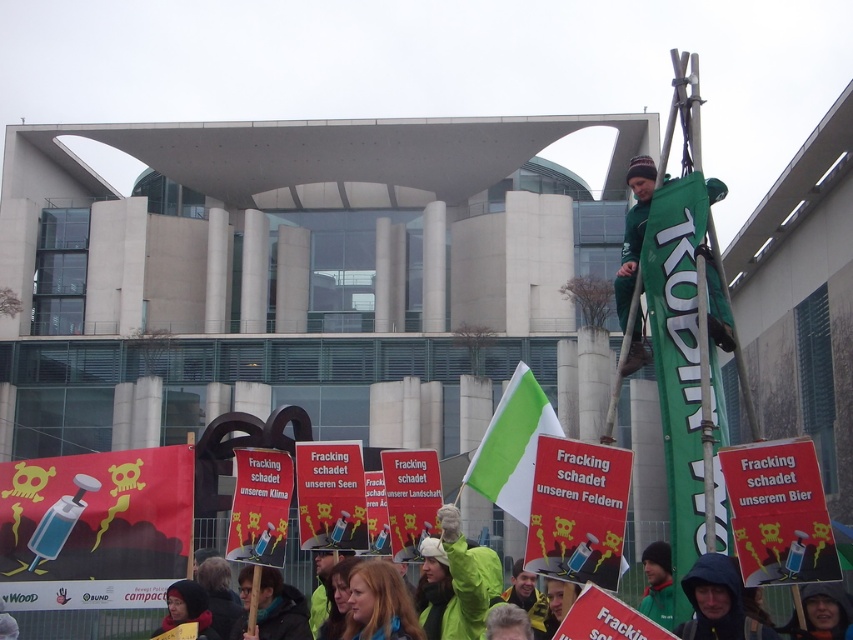
Is green fabric flag at center taller than green fabric scarf at lower center?

Yes.

Who is more forward, (492, 445) or (268, 600)?

Positioned in front is point (492, 445).

From the picture: Measure the distance between point (523,440) and camera.

They are 35.77 meters apart.

The width and height of the screenshot is (853, 640). I want to click on green fabric flag at center, so click(x=512, y=445).

Does green fabric banner at upper right have a smaller size compared to green fabric scarf at lower center?

Incorrect, green fabric banner at upper right is not smaller in size than green fabric scarf at lower center.

Which is behind, point (633, 227) or point (287, 604)?

The point (287, 604) is behind.

Locate an element on the screen. This screenshot has height=640, width=853. green fabric banner at upper right is located at coordinates (633, 234).

Measure the distance between green fabric flag at center and green fabric banner at upper right.

The distance of green fabric flag at center from green fabric banner at upper right is 9.50 meters.

Does green fabric flag at center appear over green fabric banner at upper right?

No.

Between point (502, 435) and point (630, 369), which one is positioned behind?

The point (630, 369) is behind.

You are a GUI agent. You are given a task and a screenshot of the screen. Output one action in this format:
    pyautogui.click(x=<x>, y=<y>)
    Task: Click on the green fabric flag at center
    This screenshot has width=853, height=640.
    Given the screenshot: What is the action you would take?
    pyautogui.click(x=512, y=445)